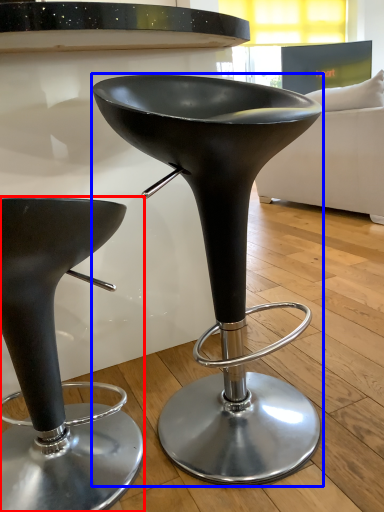
Question: Which object is further to the camera taking this photo, stool (highlighted by a red box) or stool (highlighted by a blue box)?

Choices:
 (A) stool
 (B) stool

Answer: (A)